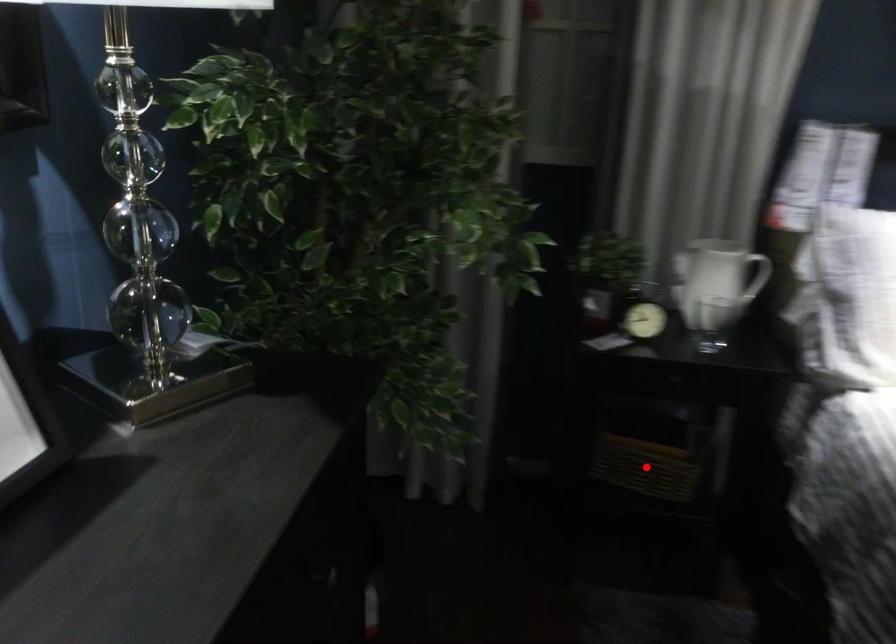
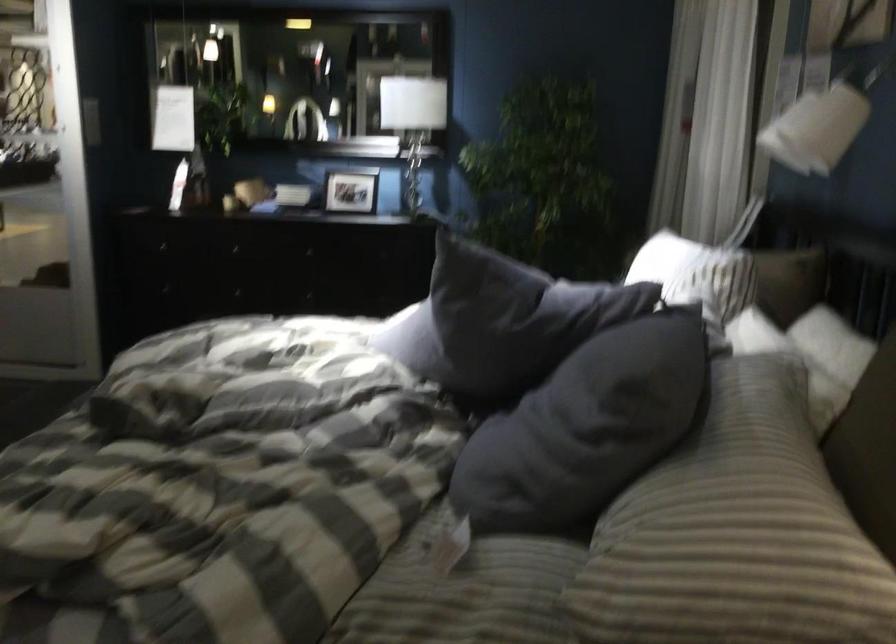
Question: I am providing you with two images of the same scene from different viewpoints. A red point is marked on the first image. Can you still see the location of the red point in image 2?

Choices:
 (A) Yes
 (B) No

Answer: (B)